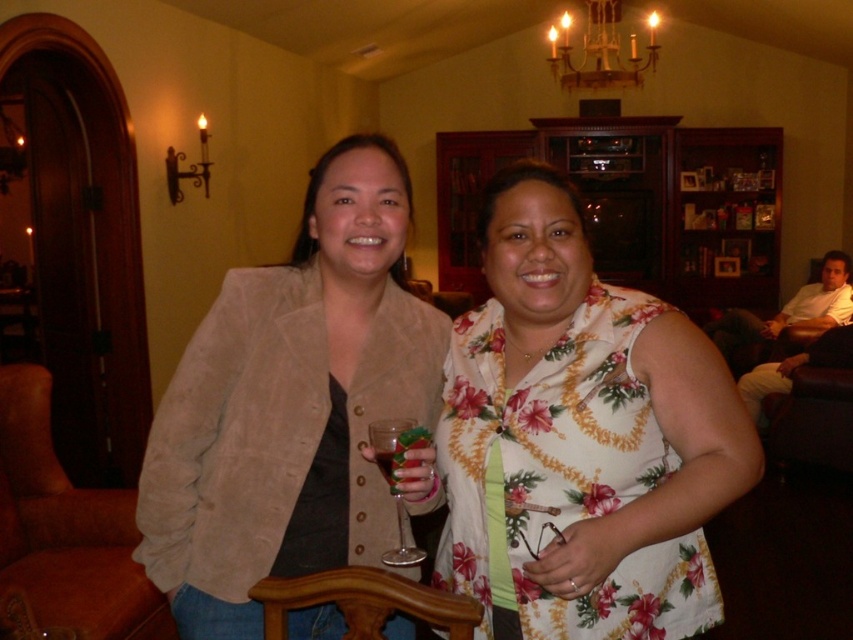
Question: Does brown suede armchair at lower left have a smaller size compared to translucent glass at center?

Choices:
 (A) no
 (B) yes

Answer: (A)

Question: Can you confirm if floral print blouse at center is smaller than suede jacket at center?

Choices:
 (A) no
 (B) yes

Answer: (B)

Question: Which object appears closest to the camera in this image?

Choices:
 (A) brown suede armchair at lower left
 (B) translucent glass at center
 (C) floral print blouse at center

Answer: (C)

Question: Which object is farther from the camera taking this photo?

Choices:
 (A) transparent glass at center
 (B) translucent glass at center

Answer: (B)

Question: Among these points, which one is nearest to the camera?

Choices:
 (A) (120, 573)
 (B) (451, 637)

Answer: (B)

Question: Is floral print blouse at center to the right of suede jacket at center from the viewer's perspective?

Choices:
 (A) no
 (B) yes

Answer: (B)